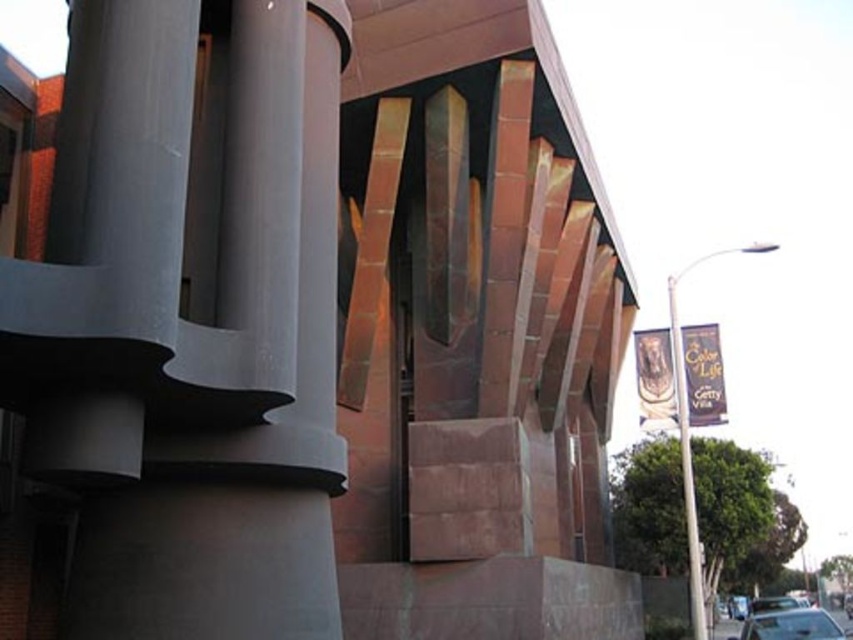
Question: Which point is closer to the camera?

Choices:
 (A) shiny silver sedan at lower right
 (B) white metallic pole at right
 (C) silver metallic pole at right
 (D) metallic silver car at lower right

Answer: (A)

Question: Considering the relative positions of silver metallic pole at right and white metallic pole at right in the image provided, where is silver metallic pole at right located with respect to white metallic pole at right?

Choices:
 (A) left
 (B) right

Answer: (B)

Question: Which object is closer to the camera taking this photo?

Choices:
 (A) shiny silver sedan at lower right
 (B) silver metallic pole at right

Answer: (A)

Question: Which point is farther from the camera taking this photo?

Choices:
 (A) (689, 573)
 (B) (755, 605)
 (C) (689, 502)

Answer: (B)

Question: Is white metallic pole at right further to camera compared to metallic silver car at lower right?

Choices:
 (A) no
 (B) yes

Answer: (A)

Question: Is silver metallic pole at right to the left of metallic silver car at lower right from the viewer's perspective?

Choices:
 (A) yes
 (B) no

Answer: (A)